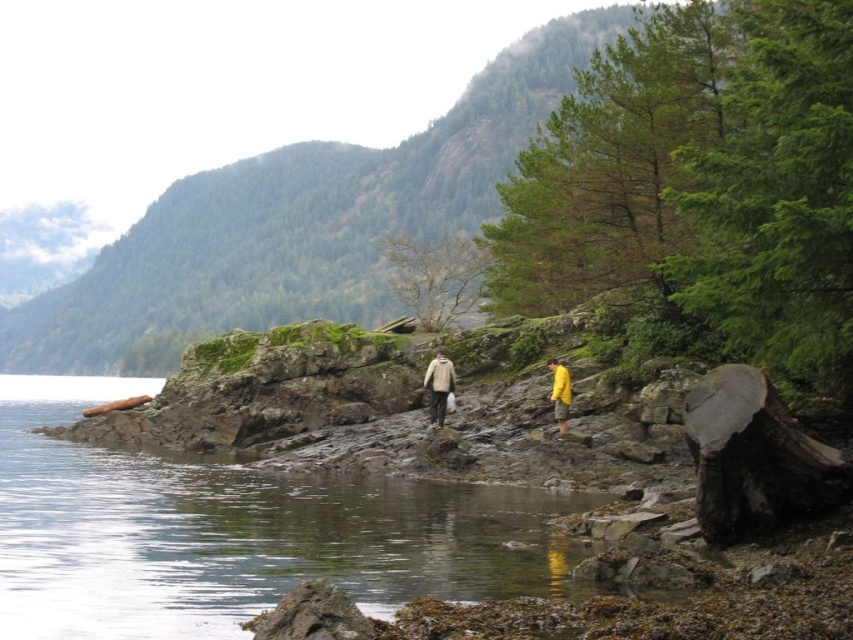
Can you confirm if clear water at center is positioned above yellow waterproof jacket at center?

No, clear water at center is not above yellow waterproof jacket at center.

Does clear water at center have a larger size compared to yellow waterproof jacket at center?

Answer: Yes, clear water at center is bigger than yellow waterproof jacket at center.

Is point (154, 387) farther from viewer compared to point (567, 378)?

Yes.

This screenshot has width=853, height=640. In order to click on clear water at center in this screenshot , I will do `click(236, 532)`.

Measure the distance between clear water at center and beige wool sweater at center.

clear water at center and beige wool sweater at center are 39.47 feet apart.

Locate an element on the screen. clear water at center is located at coordinates (236, 532).

You are a GUI agent. You are given a task and a screenshot of the screen. Output one action in this format:
    pyautogui.click(x=<x>, y=<y>)
    Task: Click on the clear water at center
    
    Given the screenshot: What is the action you would take?
    pyautogui.click(x=236, y=532)

Who is lower down, clear water at center or brown wood log at lower left?

clear water at center is below.

Does clear water at center appear on the right side of brown wood log at lower left?

Correct, you'll find clear water at center to the right of brown wood log at lower left.

Which is in front, point (13, 540) or point (90, 413)?

Point (13, 540) is in front.

Where is `clear water at center`? This screenshot has width=853, height=640. clear water at center is located at coordinates (236, 532).